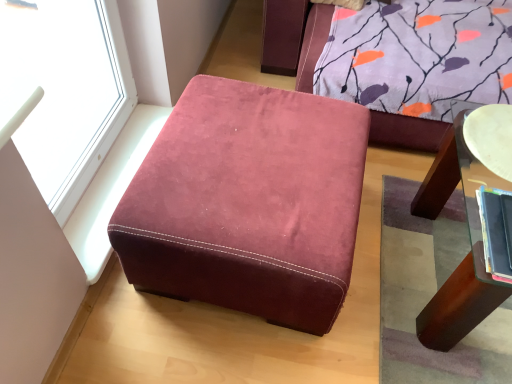
Question: From the image's perspective, does white glossy plate at upper right appear higher than transparent glass window at upper left?

Choices:
 (A) yes
 (B) no

Answer: (B)

Question: Is white glossy plate at upper right further to the viewer compared to transparent glass window at upper left?

Choices:
 (A) yes
 (B) no

Answer: (A)

Question: Is white glossy plate at upper right touching transparent glass window at upper left?

Choices:
 (A) yes
 (B) no

Answer: (B)

Question: Does white glossy plate at upper right have a lesser width compared to transparent glass window at upper left?

Choices:
 (A) no
 (B) yes

Answer: (A)

Question: From a real-world perspective, is white glossy plate at upper right located beneath transparent glass window at upper left?

Choices:
 (A) no
 (B) yes

Answer: (B)

Question: Does white glossy plate at upper right appear on the left side of transparent glass window at upper left?

Choices:
 (A) no
 (B) yes

Answer: (A)

Question: Is suede-like burgundy ottoman at center positioned behind hardcover book at right?

Choices:
 (A) yes
 (B) no

Answer: (A)

Question: Does suede-like burgundy ottoman at center appear on the left side of hardcover book at right?

Choices:
 (A) no
 (B) yes

Answer: (B)

Question: From a real-world perspective, does suede-like burgundy ottoman at center sit lower than hardcover book at right?

Choices:
 (A) yes
 (B) no

Answer: (A)

Question: Is suede-like burgundy ottoman at center bigger than hardcover book at right?

Choices:
 (A) no
 (B) yes

Answer: (B)

Question: Is suede-like burgundy ottoman at center facing towards hardcover book at right?

Choices:
 (A) no
 (B) yes

Answer: (B)

Question: Is suede-like burgundy ottoman at center positioned far away from hardcover book at right?

Choices:
 (A) no
 (B) yes

Answer: (A)

Question: From the image's perspective, is white glossy plate at upper right below hardcover book at right?

Choices:
 (A) no
 (B) yes

Answer: (A)